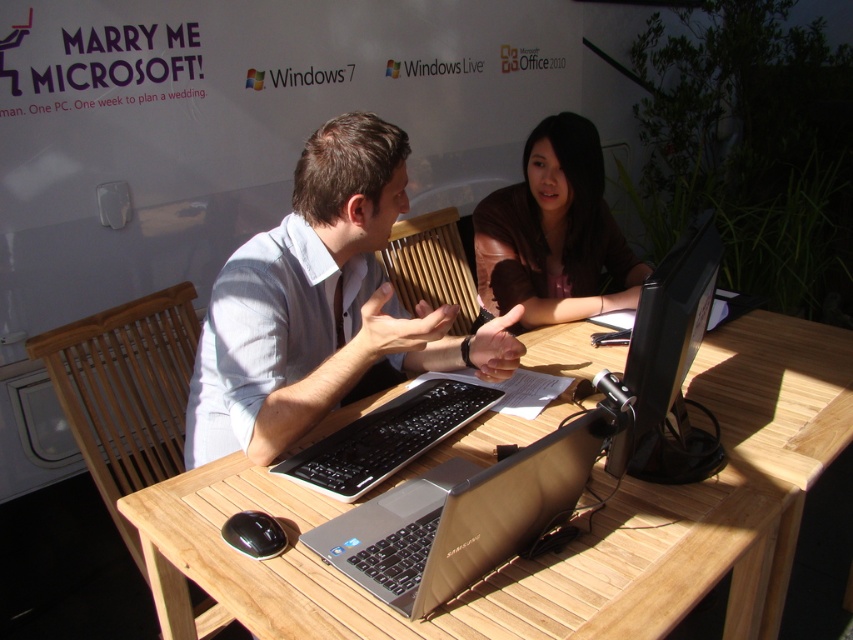
You are a photographer at the event and need to capture a closeup of the silver metallic laptop at center without the black glossy mouse at lower left appearing in the frame. Is this possible given their positions?

The silver metallic laptop at center is positioned over the black glossy mouse at lower left, so it is possible to capture a closeup of the silver metallic laptop at center without the mouse appearing in the frame by focusing on the laptop and adjusting the camera angle to exclude the mouse beneath it.

You are a photographer at the event and need to take a photo of the wooden table at center and the light blue shirt at center. The banner says,

The wooden table at center is positioned under the light blue shirt at center, so the banner slogan will be visible in the background of the photo.